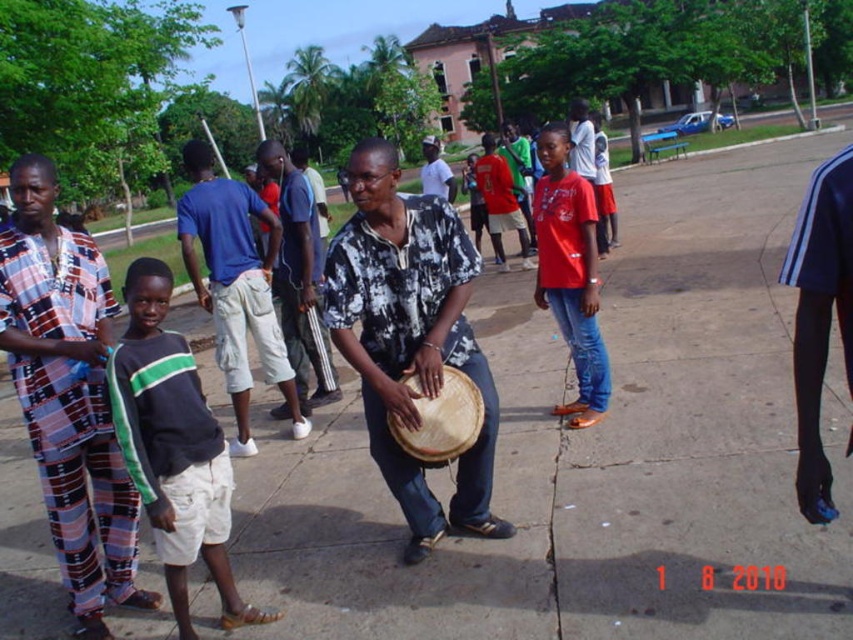
Question: Is red matte shirt at center closer to the viewer compared to natural woven drum at center?

Choices:
 (A) no
 (B) yes

Answer: (A)

Question: Which object appears farthest from the camera in this image?

Choices:
 (A) natural woven drum at center
 (B) plaid fabric shirt at left
 (C) red matte shirt at center

Answer: (C)

Question: Which object appears farthest from the camera in this image?

Choices:
 (A) red matte shirt at center
 (B) plaid fabric shirt at left
 (C) natural woven drum at center
 (D) matte black shirt at center

Answer: (A)

Question: Which point is closer to the camera?

Choices:
 (A) (589, 404)
 (B) (424, 321)
 (C) (149, 396)
 (D) (86, 611)

Answer: (C)

Question: Is plaid fabric shirt at left smaller than red matte shirt at center?

Choices:
 (A) no
 (B) yes

Answer: (A)

Question: Is plaid fabric shirt at left wider than natural woven drum at center?

Choices:
 (A) no
 (B) yes

Answer: (B)